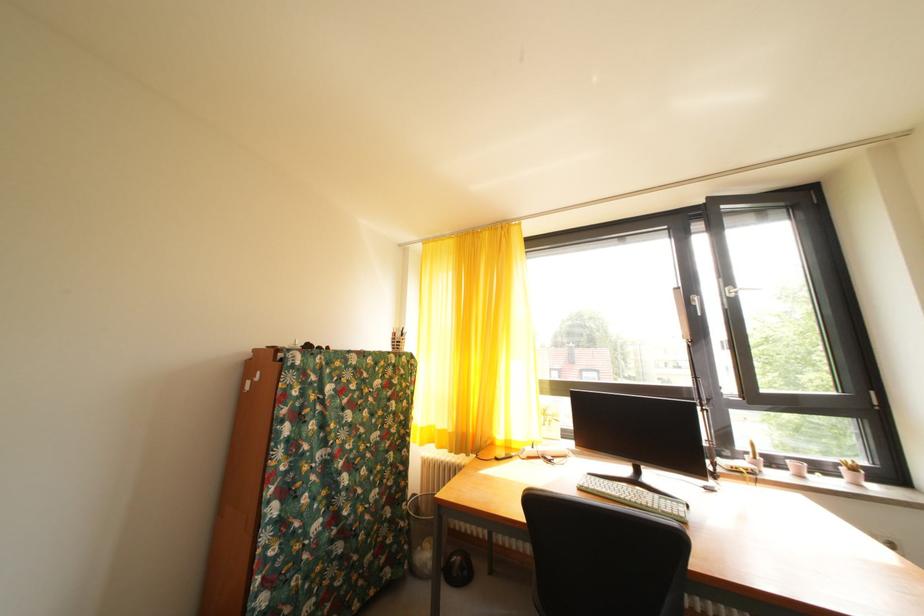
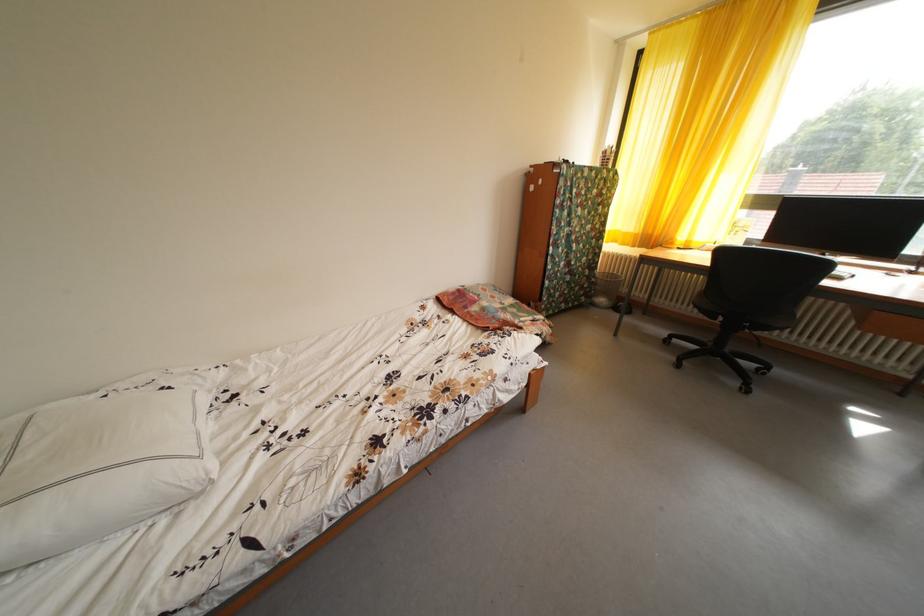
Where in the second image is the point corresponding to [398,546] from the first image?

(594, 292)